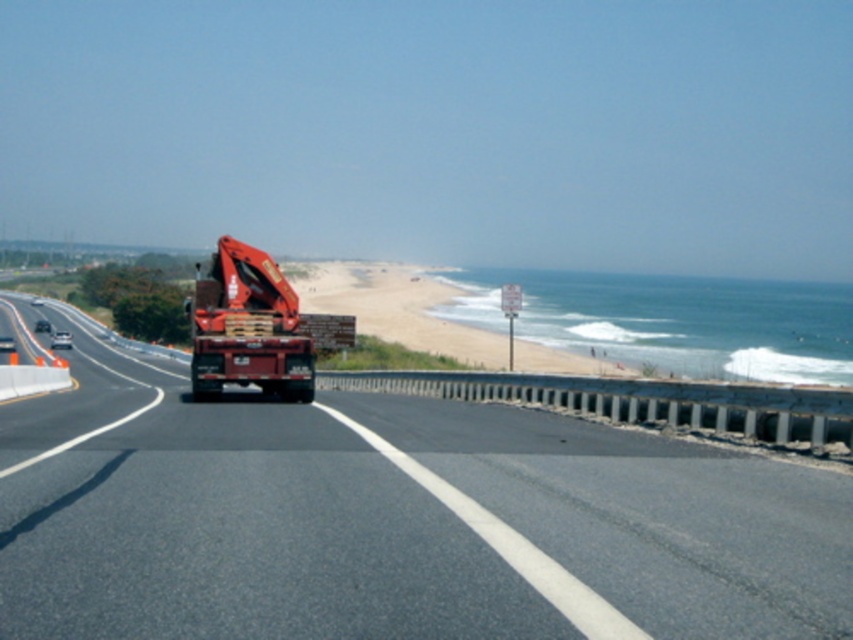
The image size is (853, 640). I want to click on smooth asphalt highway at center, so click(x=393, y=522).

Does smooth asphalt highway at center lie in front of matte red trailer truck at center?

Yes, smooth asphalt highway at center is closer to the viewer.

Does point (582, 624) lie in front of point (231, 307)?

Yes, it is in front of point (231, 307).

Where is `smooth asphalt highway at center`? smooth asphalt highway at center is located at coordinates [393, 522].